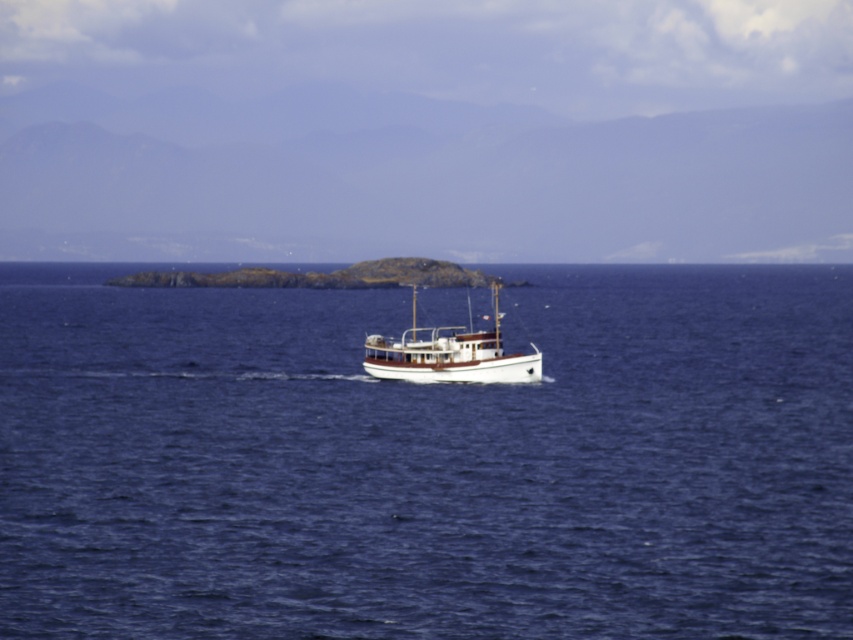
Is blue water at center bigger than wooden boat at center?

Yes, blue water at center is bigger than wooden boat at center.

Between blue water at center and wooden boat at center, which one is positioned higher?

Positioned higher is wooden boat at center.

This screenshot has height=640, width=853. What are the coordinates of `blue water at center` in the screenshot? It's located at (427, 461).